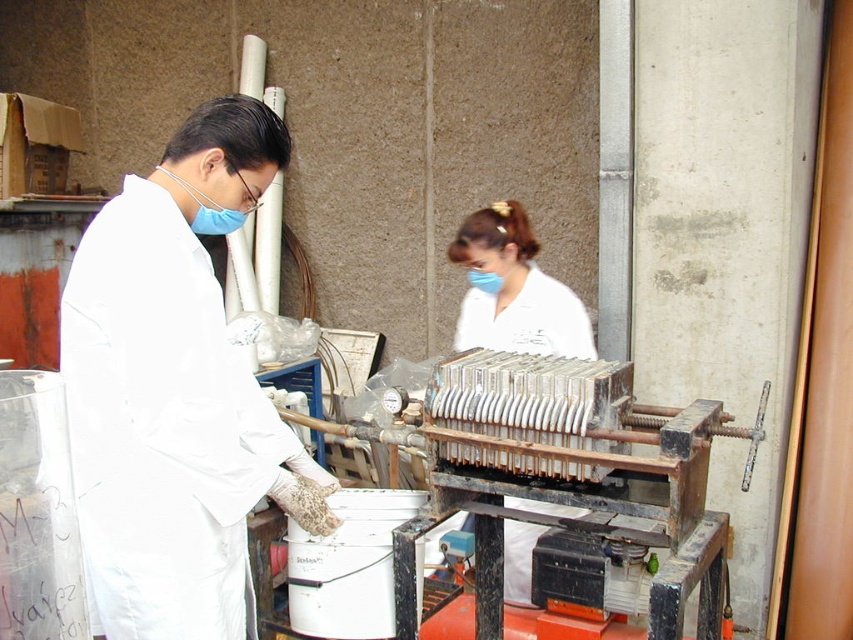
Who is lower down, white matte lab coat at left or rusty metal press at center?

rusty metal press at center

Where is `white matte lab coat at left`? The width and height of the screenshot is (853, 640). white matte lab coat at left is located at coordinates (177, 392).

Based on the photo, is white matte lab coat at left wider than white matte uniform at center?

Correct, the width of white matte lab coat at left exceeds that of white matte uniform at center.

Who is positioned more to the left, white matte lab coat at left or white matte uniform at center?

From the viewer's perspective, white matte lab coat at left appears more on the left side.

Which is in front, point (135, 449) or point (512, 205)?

Point (135, 449)

Find the location of a particular element. The width and height of the screenshot is (853, 640). white matte lab coat at left is located at coordinates (177, 392).

In the scene shown: Who is more forward, (491, 490) or (474, 216)?

Point (491, 490)

Can you confirm if rusty metal press at center is taller than white matte uniform at center?

Yes.

Measure the distance between point [763,416] and camera.

Point [763,416] and camera are 6.50 feet apart from each other.

Find the location of a particular element. The image size is (853, 640). rusty metal press at center is located at coordinates pos(563,458).